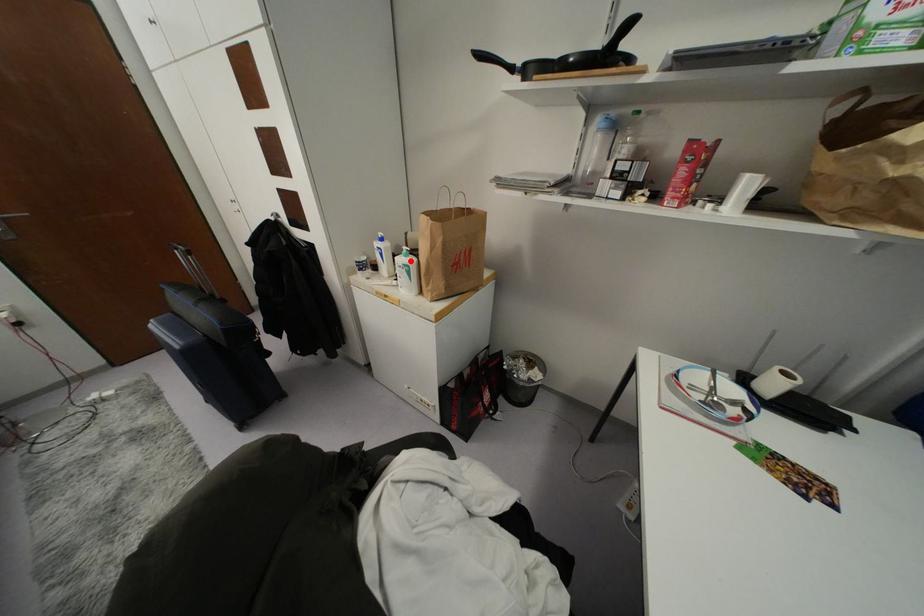
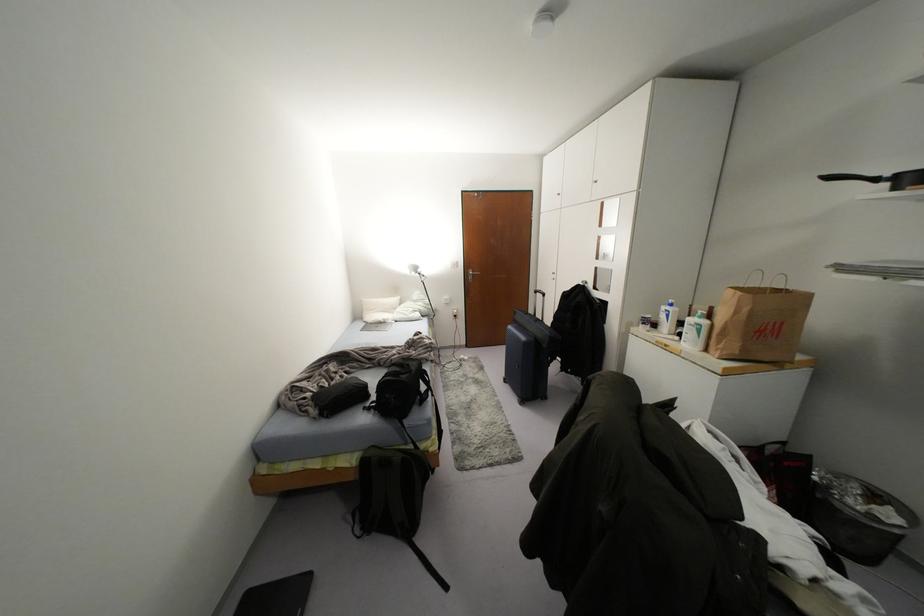
Where in the second image is the point corresponding to the highlighted location from the first image?

(703, 322)